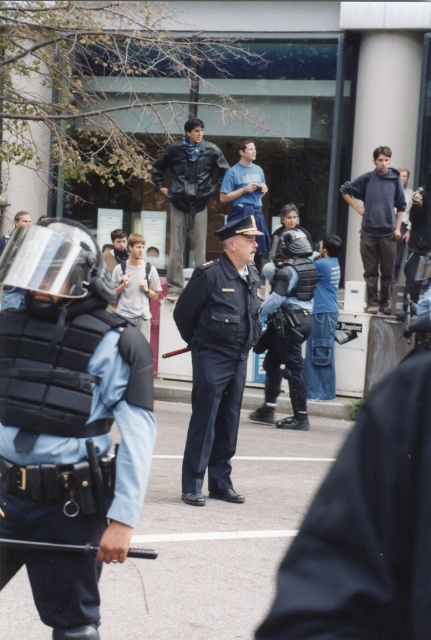
Question: Which object appears farthest from the camera in this image?

Choices:
 (A) matte black vest at left
 (B) leather jacket at center
 (C) blue cotton t-shirt at center
 (D) light gray uniform at center

Answer: (B)

Question: Does dark blue uniform at center appear under blue cotton t-shirt at center?

Choices:
 (A) no
 (B) yes

Answer: (B)

Question: Among these points, which one is nearest to the camera?

Choices:
 (A) (140, 241)
 (B) (239, 198)
 (C) (387, 225)

Answer: (C)

Question: In this image, where is matte black vest at center located relative to leather jacket at center?

Choices:
 (A) right
 (B) left

Answer: (A)

Question: Is matte black vest at left bigger than dark blue uniform at center?

Choices:
 (A) yes
 (B) no

Answer: (B)

Question: Considering the real-world distances, which object is closest to the dark blue uniform at center?

Choices:
 (A) light gray uniform at center
 (B) matte black vest at left
 (C) blue cotton t-shirt at center

Answer: (B)